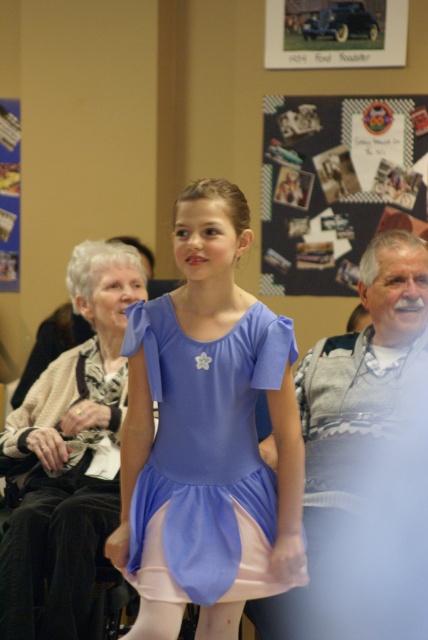
Is point (353, 209) less distant than point (14, 536)?

No, it is behind (14, 536).

Which is behind, point (293, 156) or point (68, 627)?

The point (293, 156) is more distant.

Is point (357, 253) positioned behind point (77, 492)?

Yes, point (357, 253) is behind point (77, 492).

This screenshot has height=640, width=428. I want to click on dark blue fabric bulletin board at upper center, so (x=336, y=186).

In order to click on metallic silver car at upper center in this screenshot , I will do `click(335, 33)`.

Is metallic silver car at upper center above metallic silver poster at left?

Yes.

Is point (326, 60) farther from camera compared to point (14, 129)?

No, (326, 60) is closer to viewer.

At what (x,y) coordinates should I click in order to perform the action: click on metallic silver car at upper center. Please return your answer as a coordinate pair (x, y). This screenshot has width=428, height=640. Looking at the image, I should click on (335, 33).

Can you confirm if dark blue fabric bulletin board at upper center is positioned to the right of metallic silver poster at left?

Yes, dark blue fabric bulletin board at upper center is to the right of metallic silver poster at left.

Does dark blue fabric bulletin board at upper center have a smaller size compared to metallic silver poster at left?

Incorrect, dark blue fabric bulletin board at upper center is not smaller in size than metallic silver poster at left.

Is point (409, 180) positioned in front of point (8, 131)?

Yes, point (409, 180) is in front of point (8, 131).

You are a GUI agent. You are given a task and a screenshot of the screen. Output one action in this format:
    pyautogui.click(x=<x>, y=<y>)
    Task: Click on the dark blue fabric bulletin board at upper center
    The height and width of the screenshot is (640, 428).
    Given the screenshot: What is the action you would take?
    pyautogui.click(x=336, y=186)